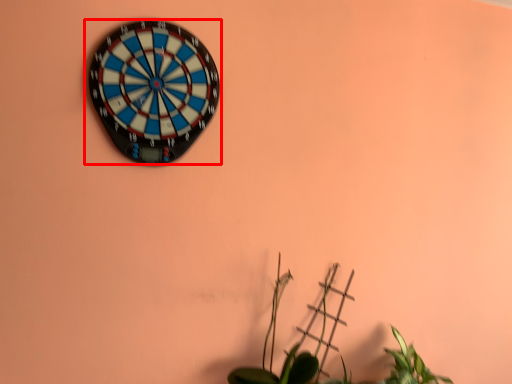
Question: From the image, what is the correct spatial relationship of wall clock (annotated by the red box) in relation to houseplant?

Choices:
 (A) right
 (B) left

Answer: (B)